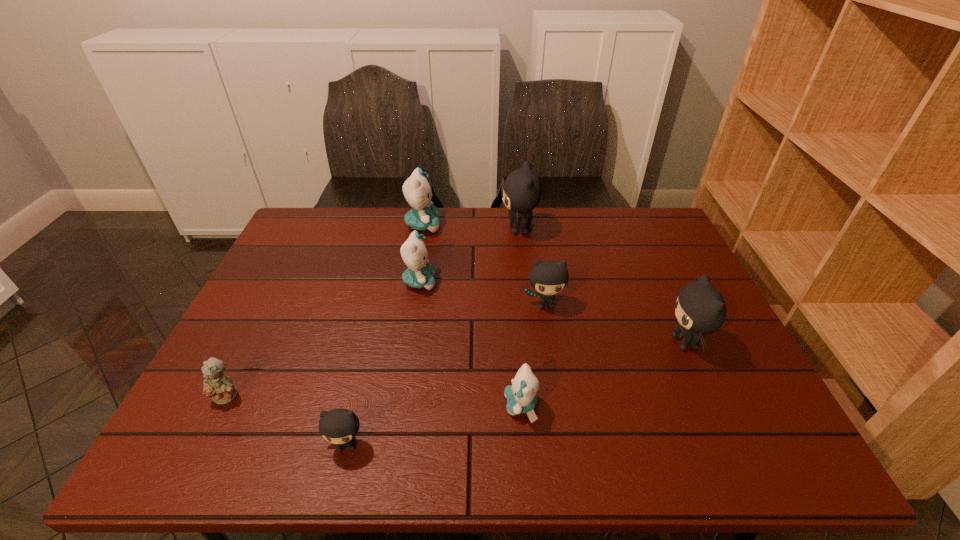
The width and height of the screenshot is (960, 540). In the image, there is a desktop. Find the location of `vacant space at the right edge`. vacant space at the right edge is located at coordinates (672, 288).

You are a GUI agent. You are given a task and a screenshot of the screen. Output one action in this format:
    pyautogui.click(x=<x>, y=<y>)
    Task: Click on the blank area at the far left corner
    This screenshot has height=540, width=960.
    Given the screenshot: What is the action you would take?
    pyautogui.click(x=307, y=232)

You are a GUI agent. You are given a task and a screenshot of the screen. Output one action in this format:
    pyautogui.click(x=<x>, y=<y>)
    Task: Click on the free space at the far right corner of the desktop
    The width and height of the screenshot is (960, 540).
    Given the screenshot: What is the action you would take?
    pyautogui.click(x=630, y=224)

At what (x,y) coordinates should I click in order to perform the action: click on empty location between the nearest object and the leftmost object. Please return your answer as a coordinate pair (x, y). This screenshot has width=960, height=540. Looking at the image, I should click on tap(287, 421).

At what (x,y) coordinates should I click in order to perform the action: click on unoccupied area between the second biggest gray kitten and the farthest gray kitten. Please return your answer as a coordinate pair (x, y). This screenshot has width=960, height=540. Looking at the image, I should click on (602, 286).

Where is `empty space between the second nearest blue kitten and the leftmost object`? The image size is (960, 540). empty space between the second nearest blue kitten and the leftmost object is located at coordinates (324, 339).

This screenshot has height=540, width=960. Identify the location of vacant area between the second smallest blue kitten and the blue teddy bear. (324, 339).

In order to click on free spot between the second biggest blue kitten and the third biggest gray kitten in this screenshot , I will do `click(483, 293)`.

Where is `free spot between the leftmost gray kitten and the second nearest blue kitten`? The image size is (960, 540). free spot between the leftmost gray kitten and the second nearest blue kitten is located at coordinates [x=383, y=363].

Find the location of a particular element. The width and height of the screenshot is (960, 540). empty space between the sixth farthest kitten and the farthest blue kitten is located at coordinates click(472, 315).